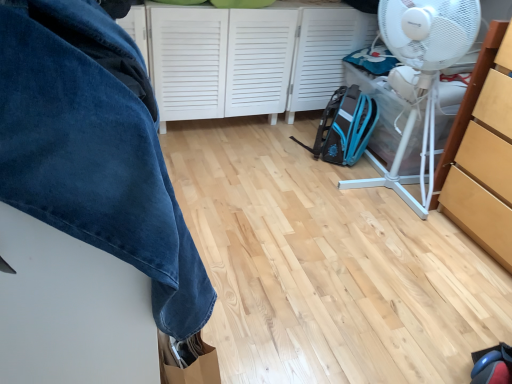
At what (x,y) coordinates should I click in order to perform the action: click on white matte cabinet at center, which is the first cabinetry from back to front. Please return your answer as a coordinate pair (x, y). Looking at the image, I should click on (x=250, y=58).

The height and width of the screenshot is (384, 512). What do you see at coordinates (344, 127) in the screenshot?
I see `teal fabric backpack at center-right` at bounding box center [344, 127].

Measure the distance between point (367, 137) and camera.

Point (367, 137) and camera are 2.37 meters apart.

Describe the element at coordinates (428, 33) in the screenshot. This screenshot has width=512, height=384. I see `white plastic mechanical fan at right` at that location.

Where is `velvety blue blanket at upper left`? velvety blue blanket at upper left is located at coordinates (88, 208).

Identify the location of white matte cabinet at center, which is the first cabinetry from back to front. (250, 58).

How much distance is there between white plastic mechanical fan at right and light wood cabinet at right, the first cabinetry viewed from the front?

white plastic mechanical fan at right is 10.37 inches away from light wood cabinet at right, the first cabinetry viewed from the front.

Is light wood cabinet at right, acting as the second cabinetry starting from the left, at the back of white plastic mechanical fan at right?

No, white plastic mechanical fan at right is not facing the opposite direction of light wood cabinet at right, acting as the second cabinetry starting from the left.

Is point (479, 12) farther from camera compared to point (481, 107)?

No, it is not.

From the image's perspective, does white plastic mechanical fan at right appear lower than light wood cabinet at right, the 2th cabinetry positioned from the back?

No.

Where is `cabinetry that appears below the teal fabric backpack at center-right (from the image's perspective)`? cabinetry that appears below the teal fabric backpack at center-right (from the image's perspective) is located at coordinates (483, 152).

From the image's perspective, is teal fabric backpack at center-right beneath light wood cabinet at right, the first cabinetry viewed from the front?

Incorrect, from the image's perspective, teal fabric backpack at center-right is higher than light wood cabinet at right, the first cabinetry viewed from the front.

Is light wood cabinet at right, the first cabinetry viewed from the front, inside teal fabric backpack at center-right?

No, light wood cabinet at right, the first cabinetry viewed from the front, is not surrounded by teal fabric backpack at center-right.

From their relative heights in the image, would you say white plastic mechanical fan at right is taller or shorter than teal fabric backpack at center-right?

Considering their sizes, white plastic mechanical fan at right has more height than teal fabric backpack at center-right.

Between point (405, 140) and point (323, 128), which one is positioned in front?

The point (405, 140) is more forward.

Can you confirm if white plastic mechanical fan at right is positioned to the left of teal fabric backpack at center-right?

No.

From the image's perspective, which one is positioned higher, white plastic mechanical fan at right or teal fabric backpack at center-right?

white plastic mechanical fan at right.

Does light wood cabinet at right, acting as the second cabinetry starting from the left, turn towards velvety blue blanket at upper left?

Yes, light wood cabinet at right, acting as the second cabinetry starting from the left, is aimed at velvety blue blanket at upper left.

Considering the relative sizes of light wood cabinet at right, the first cabinetry viewed from the front, and velvety blue blanket at upper left in the image provided, is light wood cabinet at right, the first cabinetry viewed from the front, smaller than velvety blue blanket at upper left?

Correct, light wood cabinet at right, the first cabinetry viewed from the front, occupies less space than velvety blue blanket at upper left.

From the image's perspective, is light wood cabinet at right, acting as the second cabinetry starting from the left, located above velvety blue blanket at upper left?

Indeed, from the image's perspective, light wood cabinet at right, acting as the second cabinetry starting from the left, is shown above velvety blue blanket at upper left.

From their relative heights in the image, would you say light wood cabinet at right, the first cabinetry viewed from the front, is taller or shorter than velvety blue blanket at upper left?

In the image, light wood cabinet at right, the first cabinetry viewed from the front, appears to be taller than velvety blue blanket at upper left.

Which object is positioned more to the left, white plastic mechanical fan at right or white matte cabinet at center, which ranks as the second cabinetry in front-to-back order?

white matte cabinet at center, which ranks as the second cabinetry in front-to-back order, is more to the left.

Are white plastic mechanical fan at right and white matte cabinet at center, which is the 1th cabinetry from left to right, far apart?

That's not correct — white plastic mechanical fan at right is a little close to white matte cabinet at center, which is the 1th cabinetry from left to right.

From the image's perspective, would you say white plastic mechanical fan at right is shown under white matte cabinet at center, placed as the second cabinetry when sorted from right to left?

Yes, from the image's perspective, white plastic mechanical fan at right is below white matte cabinet at center, placed as the second cabinetry when sorted from right to left.

Does point (392, 4) appear closer or farther from the camera than point (308, 61)?

Point (392, 4).

Could you tell me if white plastic mechanical fan at right is facing velvety blue blanket at upper left?

Yes, white plastic mechanical fan at right is aimed at velvety blue blanket at upper left.

From a real-world perspective, is white plastic mechanical fan at right positioned under velvety blue blanket at upper left based on gravity?

No, from a real-world perspective, white plastic mechanical fan at right is not beneath velvety blue blanket at upper left.

Could velvety blue blanket at upper left be considered to be inside white plastic mechanical fan at right?

That's incorrect, velvety blue blanket at upper left is not inside white plastic mechanical fan at right.

You are a GUI agent. You are given a task and a screenshot of the screen. Output one action in this format:
    pyautogui.click(x=<x>, y=<y>)
    Task: Click on the furniture on the left of white plastic mechanical fan at right
    The image size is (512, 384).
    Given the screenshot: What is the action you would take?
    pyautogui.click(x=88, y=208)

From the image's perspective, is light wood cabinet at right, which is the 1th cabinetry from right to left, on white matte cabinet at center, which is the first cabinetry from back to front?

No, from the image's perspective, light wood cabinet at right, which is the 1th cabinetry from right to left, is not on top of white matte cabinet at center, which is the first cabinetry from back to front.

Where is `cabinetry located behind the light wood cabinet at right, which is the 1th cabinetry from right to left`? The width and height of the screenshot is (512, 384). cabinetry located behind the light wood cabinet at right, which is the 1th cabinetry from right to left is located at coordinates click(x=250, y=58).

Considering the sizes of objects light wood cabinet at right, the first cabinetry viewed from the front, and white matte cabinet at center, which is the first cabinetry from back to front, in the image provided, who is wider, light wood cabinet at right, the first cabinetry viewed from the front, or white matte cabinet at center, which is the first cabinetry from back to front,?

light wood cabinet at right, the first cabinetry viewed from the front, is wider.

Based on the photo, how many degrees apart are the facing directions of light wood cabinet at right, acting as the second cabinetry starting from the left, and white matte cabinet at center, which ranks as the second cabinetry in front-to-back order?

The angular difference between light wood cabinet at right, acting as the second cabinetry starting from the left, and white matte cabinet at center, which ranks as the second cabinetry in front-to-back order, is 90.8 degrees.

Where is `cabinetry that is the 1st object directly below the white plastic mechanical fan at right (from a real-world perspective)`? cabinetry that is the 1st object directly below the white plastic mechanical fan at right (from a real-world perspective) is located at coordinates 483,152.

Image resolution: width=512 pixels, height=384 pixels. Identify the location of the 2nd cabinetry directly above the teal fabric backpack at center-right (from a real-world perspective). (483, 152).

In the scene shown: Considering their positions, is velvety blue blanket at upper left positioned closer to light wood cabinet at right, the first cabinetry viewed from the front, than white plastic mechanical fan at right?

white plastic mechanical fan at right.

In the scene shown: From the image, which object appears to be nearer to velvety blue blanket at upper left, white plastic mechanical fan at right or light wood cabinet at right, acting as the second cabinetry starting from the left?

white plastic mechanical fan at right is closer to velvety blue blanket at upper left.

From the image, which object appears to be farther from white matte cabinet at center, which is the 1th cabinetry from left to right, teal fabric backpack at center-right or velvety blue blanket at upper left?

The object further to white matte cabinet at center, which is the 1th cabinetry from left to right, is velvety blue blanket at upper left.

Looking at the image, which one is located closer to white matte cabinet at center, placed as the second cabinetry when sorted from right to left, teal fabric backpack at center-right or white plastic mechanical fan at right?

teal fabric backpack at center-right is positioned closer to the anchor white matte cabinet at center, placed as the second cabinetry when sorted from right to left.

Estimate the real-world distances between objects in this image. Which object is further from velvety blue blanket at upper left, teal fabric backpack at center-right or white plastic mechanical fan at right?

teal fabric backpack at center-right lies further to velvety blue blanket at upper left than the other object.

Considering their positions, is light wood cabinet at right, the 2th cabinetry positioned from the back, positioned further to white plastic mechanical fan at right than velvety blue blanket at upper left?

velvety blue blanket at upper left lies further to white plastic mechanical fan at right than the other object.

Based on their spatial positions, is light wood cabinet at right, acting as the second cabinetry starting from the left, or teal fabric backpack at center-right further from white plastic mechanical fan at right?

→ teal fabric backpack at center-right.

Estimate the real-world distances between objects in this image. Which object is closer to white matte cabinet at center, which is the first cabinetry from back to front, white plastic mechanical fan at right or light wood cabinet at right, acting as the second cabinetry starting from the left?

white plastic mechanical fan at right.

Locate an element on the screen. This screenshot has width=512, height=384. mechanical fan between light wood cabinet at right, the 2th cabinetry positioned from the back, and teal fabric backpack at center-right, along the z-axis is located at coordinates (428, 33).

Identify the location of backpack between velvety blue blanket at upper left and light wood cabinet at right, the 2th cabinetry positioned from the back, from left to right. The image size is (512, 384). (344, 127).

Locate an element on the screen. backpack located between white matte cabinet at center, which is the first cabinetry from back to front, and white plastic mechanical fan at right in the left-right direction is located at coordinates (344, 127).

Identify the location of mechanical fan positioned between velvety blue blanket at upper left and white matte cabinet at center, which ranks as the second cabinetry in front-to-back order, from near to far. (428, 33).